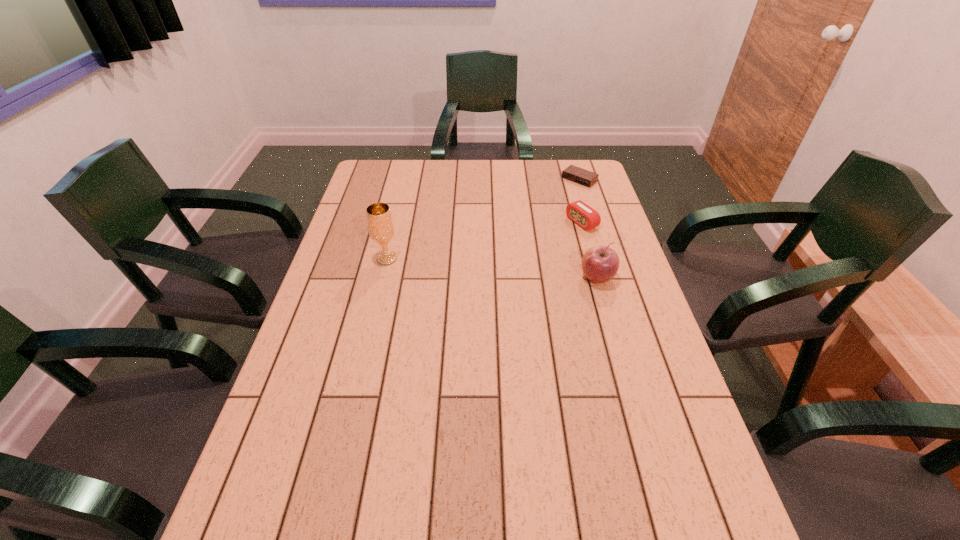
Identify the location of free space on the desktop that is between the tallest object and the apple and is positioned on the front-facing side of the third nearest object. (477, 267).

Find the location of a particular element. The height and width of the screenshot is (540, 960). free space on the desktop that is between the leftmost object and the second tallest object and is positioned on the front face of the shortest object is located at coordinates (474, 267).